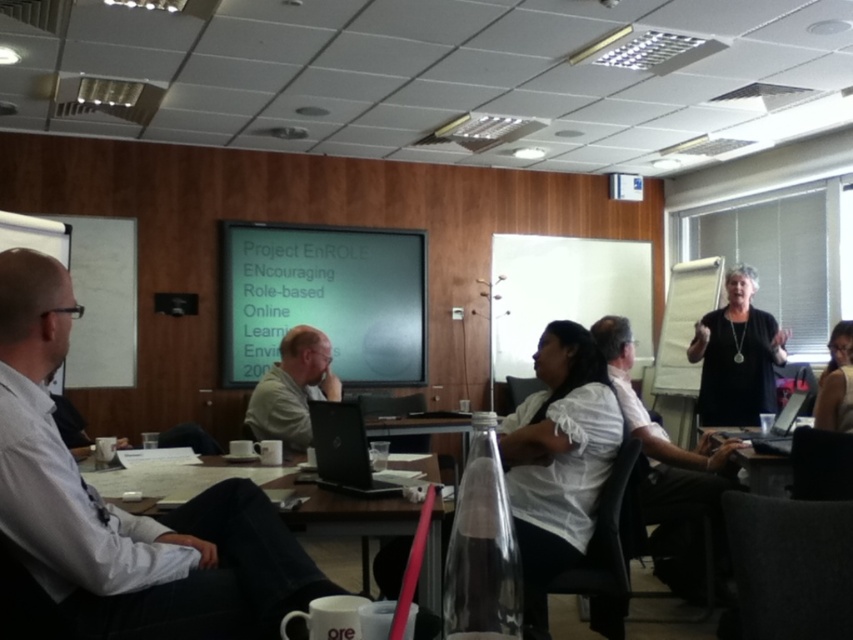
Is black fabric at center to the left of clear plastic table at center from the viewer's perspective?

In fact, black fabric at center is to the right of clear plastic table at center.

This screenshot has height=640, width=853. What do you see at coordinates (737, 355) in the screenshot?
I see `black fabric at center` at bounding box center [737, 355].

Find the location of `black fabric at center`. black fabric at center is located at coordinates (737, 355).

Who is lower down, white shirt at center or clear plastic table at center?

clear plastic table at center is below.

Does point (706, 440) come in front of point (463, 413)?

Yes.

Is point (718, 497) less distant than point (462, 444)?

Yes, it is in front of point (462, 444).

At what (x,y) coordinates should I click in order to perform the action: click on white shirt at center. Please return your answer as a coordinate pair (x, y). The image size is (853, 640). Looking at the image, I should click on (669, 470).

Between white shirt at center and black fabric at center, which one has less height?

With less height is black fabric at center.

How much distance is there between white shirt at center and black fabric at center?

white shirt at center is 5.00 feet away from black fabric at center.

Is point (647, 442) positioned behind point (751, 400)?

No, it is not.

Locate an element on the screen. white shirt at center is located at coordinates (669, 470).